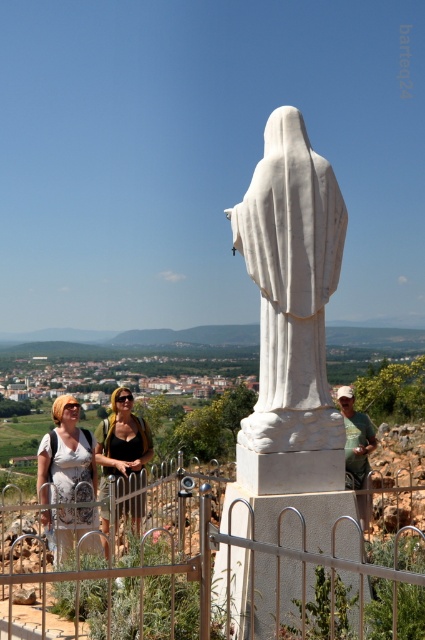
Based on the photo, you are a photographer trying to capture a photo of the white marble statue at center and the matte white blouse at center. Based on their sizes, which object should you focus on first if you want to ensure both are in frame?

The white marble statue at center is smaller than the matte white blouse at center, so you should focus on the matte white blouse at center first to ensure both are in frame.

Based on the scene description, where is the white marble statue at center located in terms of coordinates?

The white marble statue at center is located at coordinates point [291,285].

You are standing in front of the statue and want to place two markers at the specified coordinates. Which point, point (266,330) or point (107,516), is closer to you?

Point (266,330) is closer to the viewer than point (107,516).